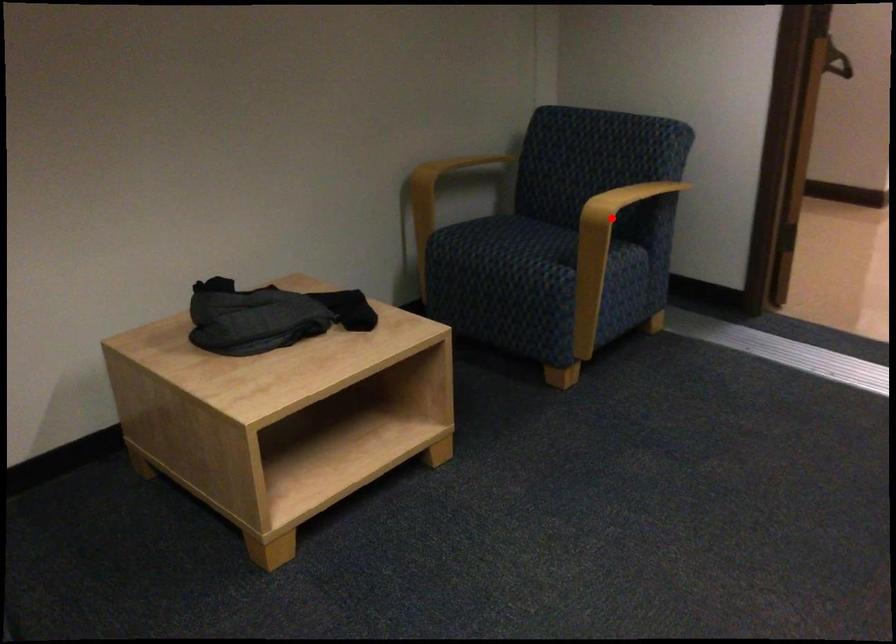
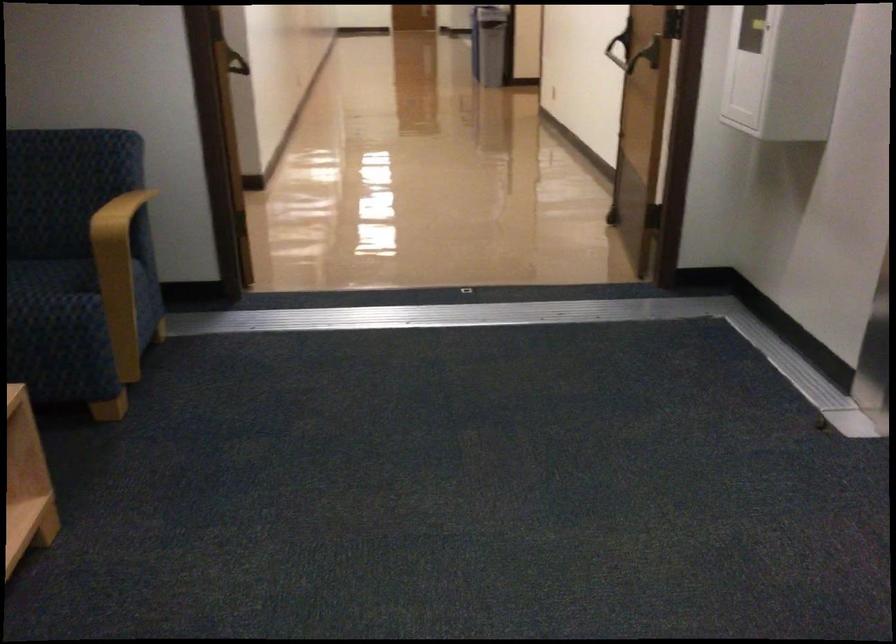
Find the pixel in the second image that matches the highlighted location in the first image.

(88, 245)